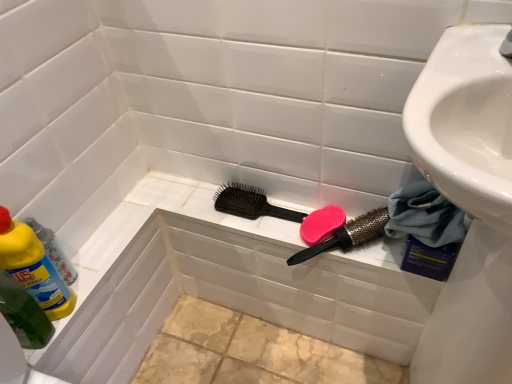
You are a GUI agent. You are given a task and a screenshot of the screen. Output one action in this format:
    pyautogui.click(x=<x>, y=<y>)
    Task: Click on the blue fabric towel at lower right
    Image resolution: width=512 pixels, height=384 pixels.
    Given the screenshot: What is the action you would take?
    pyautogui.click(x=424, y=215)

Looking at this image, measure the distance between point (13, 269) and camera.

Point (13, 269) is 73.80 centimeters away from camera.

In order to face green plastic bottle at left, should I rotate leftwards or rightwards?

It's best to rotate left around 28.572 degrees.

Where is `black plastic hairbrush at center, the first brush when ordered from left to right`? The width and height of the screenshot is (512, 384). black plastic hairbrush at center, the first brush when ordered from left to right is located at coordinates (250, 203).

How much space does black plastic hairbrush at center, the first brush when ordered from left to right, occupy horizontally?

black plastic hairbrush at center, the first brush when ordered from left to right, is 3.60 inches in width.

What do you see at coordinates (348, 235) in the screenshot? I see `pink rubber brush at center, arranged as the 2th brush when viewed from the left` at bounding box center [348, 235].

At what (x,y) coordinates should I click in order to perform the action: click on blue fabric towel at lower right. Please return your answer as a coordinate pair (x, y). Looking at the image, I should click on (424, 215).

Can you confirm if black plastic hairbrush at center, which ranks as the second brush in right-to-left order, is positioned to the right of green plastic bottle at left?

Correct, you'll find black plastic hairbrush at center, which ranks as the second brush in right-to-left order, to the right of green plastic bottle at left.

Does black plastic hairbrush at center, which ranks as the second brush in right-to-left order, touch green plastic bottle at left?

No, black plastic hairbrush at center, which ranks as the second brush in right-to-left order, is not beside green plastic bottle at left.

Based on the photo, is black plastic hairbrush at center, the first brush when ordered from left to right, wider than green plastic bottle at left?

Incorrect, the width of black plastic hairbrush at center, the first brush when ordered from left to right, does not surpass that of green plastic bottle at left.

Considering the sizes of black plastic hairbrush at center, the first brush when ordered from left to right, and green plastic bottle at left in the image, is black plastic hairbrush at center, the first brush when ordered from left to right, bigger or smaller than green plastic bottle at left?

black plastic hairbrush at center, the first brush when ordered from left to right, is smaller than green plastic bottle at left.

From the image's perspective, which one is positioned higher, green plastic bottle at left or pink rubber brush at center, the first brush in the right-to-left sequence?

pink rubber brush at center, the first brush in the right-to-left sequence.

Considering the relative sizes of green plastic bottle at left and pink rubber brush at center, arranged as the 2th brush when viewed from the left, in the image provided, is green plastic bottle at left taller than pink rubber brush at center, arranged as the 2th brush when viewed from the left,?

Correct, green plastic bottle at left is much taller as pink rubber brush at center, arranged as the 2th brush when viewed from the left.

Is green plastic bottle at left with pink rubber brush at center, the first brush in the right-to-left sequence?

No, green plastic bottle at left is not with pink rubber brush at center, the first brush in the right-to-left sequence.

Is green plastic bottle at left placed right next to black plastic hairbrush at center, which ranks as the second brush in right-to-left order?

No, green plastic bottle at left is not next to black plastic hairbrush at center, which ranks as the second brush in right-to-left order.

Considering the sizes of objects green plastic bottle at left and black plastic hairbrush at center, which ranks as the second brush in right-to-left order, in the image provided, who is shorter, green plastic bottle at left or black plastic hairbrush at center, which ranks as the second brush in right-to-left order,?

black plastic hairbrush at center, which ranks as the second brush in right-to-left order, is shorter.

Is green plastic bottle at left located outside black plastic hairbrush at center, which ranks as the second brush in right-to-left order?

Yes, green plastic bottle at left is located beyond the bounds of black plastic hairbrush at center, which ranks as the second brush in right-to-left order.

Is green plastic bottle at left closer to the viewer compared to black plastic hairbrush at center, which ranks as the second brush in right-to-left order?

That is True.

In terms of width, does green plastic bottle at left look wider or thinner when compared to blue fabric towel at lower right?

Considering their sizes, green plastic bottle at left looks slimmer than blue fabric towel at lower right.

Can you confirm if green plastic bottle at left is bigger than blue fabric towel at lower right?

No.

From a real-world perspective, is green plastic bottle at left on blue fabric towel at lower right?

Yes.

This screenshot has width=512, height=384. What are the coordinates of `cleaning product to the left of blue fabric towel at lower right` in the screenshot? It's located at (33, 267).

From a real-world perspective, is pink matte comb at center below pink rubber brush at center, arranged as the 2th brush when viewed from the left?

Yes.

Would you say pink matte comb at center is inside or outside pink rubber brush at center, arranged as the 2th brush when viewed from the left?

pink matte comb at center is located inside pink rubber brush at center, arranged as the 2th brush when viewed from the left.

Does pink matte comb at center lie behind pink rubber brush at center, arranged as the 2th brush when viewed from the left?

Yes, it is behind pink rubber brush at center, arranged as the 2th brush when viewed from the left.

Does pink matte comb at center have a smaller size compared to pink rubber brush at center, arranged as the 2th brush when viewed from the left?

Indeed, pink matte comb at center has a smaller size compared to pink rubber brush at center, arranged as the 2th brush when viewed from the left.

Looking at their sizes, would you say black plastic hairbrush at center, the first brush when ordered from left to right, is wider or thinner than pink matte comb at center?

black plastic hairbrush at center, the first brush when ordered from left to right, is thinner than pink matte comb at center.

Does black plastic hairbrush at center, the first brush when ordered from left to right, turn towards pink matte comb at center?

No, black plastic hairbrush at center, the first brush when ordered from left to right, is not turned towards pink matte comb at center.

Does black plastic hairbrush at center, the first brush when ordered from left to right, have a lesser height compared to pink matte comb at center?

Correct, black plastic hairbrush at center, the first brush when ordered from left to right, is not as tall as pink matte comb at center.

Is blue fabric towel at lower right positioned beyond the bounds of green plastic bottle at left?

blue fabric towel at lower right is positioned outside green plastic bottle at left.

Does blue fabric towel at lower right touch green plastic bottle at left?

No, blue fabric towel at lower right is not touching green plastic bottle at left.

Is blue fabric towel at lower right in front of green plastic bottle at left?

No, blue fabric towel at lower right is further to the viewer.

Between blue fabric towel at lower right and green plastic bottle at left, which one has larger width?

Wider between the two is blue fabric towel at lower right.

Locate an element on the screen. This screenshot has height=384, width=512. the 2nd brush behind when counting from the green plastic bottle at left is located at coordinates (250, 203).

This screenshot has height=384, width=512. What are the coordinates of `the 1st brush above when counting from the green plastic bottle at left (from the image's perspective)` in the screenshot? It's located at (348, 235).

Which object lies nearer to the anchor point black plastic hairbrush at center, which ranks as the second brush in right-to-left order, blue fabric towel at lower right or pink matte comb at center?

Among the two, pink matte comb at center is located nearer to black plastic hairbrush at center, which ranks as the second brush in right-to-left order.

Looking at the image, which one is located closer to pink matte comb at center, blue fabric towel at lower right or black plastic hairbrush at center, the first brush when ordered from left to right?

The object closer to pink matte comb at center is black plastic hairbrush at center, the first brush when ordered from left to right.

Consider the image. When comparing their distances from pink rubber brush at center, arranged as the 2th brush when viewed from the left, does blue fabric towel at lower right or green plastic bottle at left seem closer?

blue fabric towel at lower right.

Estimate the real-world distances between objects in this image. Which object is further from green plastic bottle at left, black plastic hairbrush at center, which ranks as the second brush in right-to-left order, or pink matte comb at center?

The object further to green plastic bottle at left is pink matte comb at center.

Based on their spatial positions, is pink rubber brush at center, the first brush in the right-to-left sequence, or green plastic bottle at left further from black plastic hairbrush at center, which ranks as the second brush in right-to-left order?

Based on the image, green plastic bottle at left appears to be further to black plastic hairbrush at center, which ranks as the second brush in right-to-left order.

Estimate the real-world distances between objects in this image. Which object is closer to green plastic bottle at left, pink rubber brush at center, arranged as the 2th brush when viewed from the left, or blue fabric towel at lower right?

The object closer to green plastic bottle at left is pink rubber brush at center, arranged as the 2th brush when viewed from the left.

In the scene shown: From the image, which object appears to be nearer to pink matte comb at center, green plastic bottle at left or black plastic hairbrush at center, which ranks as the second brush in right-to-left order?

black plastic hairbrush at center, which ranks as the second brush in right-to-left order, is closer to pink matte comb at center.

When comparing their distances from blue fabric towel at lower right, does pink rubber brush at center, the first brush in the right-to-left sequence, or black plastic hairbrush at center, the first brush when ordered from left to right, seem further?

The object further to blue fabric towel at lower right is black plastic hairbrush at center, the first brush when ordered from left to right.

Where is `brush situated between pink matte comb at center and blue fabric towel at lower right from left to right`? This screenshot has width=512, height=384. brush situated between pink matte comb at center and blue fabric towel at lower right from left to right is located at coordinates (348, 235).

You are a GUI agent. You are given a task and a screenshot of the screen. Output one action in this format:
    pyautogui.click(x=<x>, y=<y>)
    Task: Click on the brush situated between green plastic bottle at left and pink matte comb at center from left to right
    
    Given the screenshot: What is the action you would take?
    pyautogui.click(x=250, y=203)

Where is `comb between black plastic hairbrush at center, which ranks as the second brush in right-to-left order, and blue fabric towel at lower right, in the horizontal direction`? comb between black plastic hairbrush at center, which ranks as the second brush in right-to-left order, and blue fabric towel at lower right, in the horizontal direction is located at coordinates (321, 224).

Where is `brush between green plastic bottle at left and pink rubber brush at center, the first brush in the right-to-left sequence, in the horizontal direction`? brush between green plastic bottle at left and pink rubber brush at center, the first brush in the right-to-left sequence, in the horizontal direction is located at coordinates (250, 203).